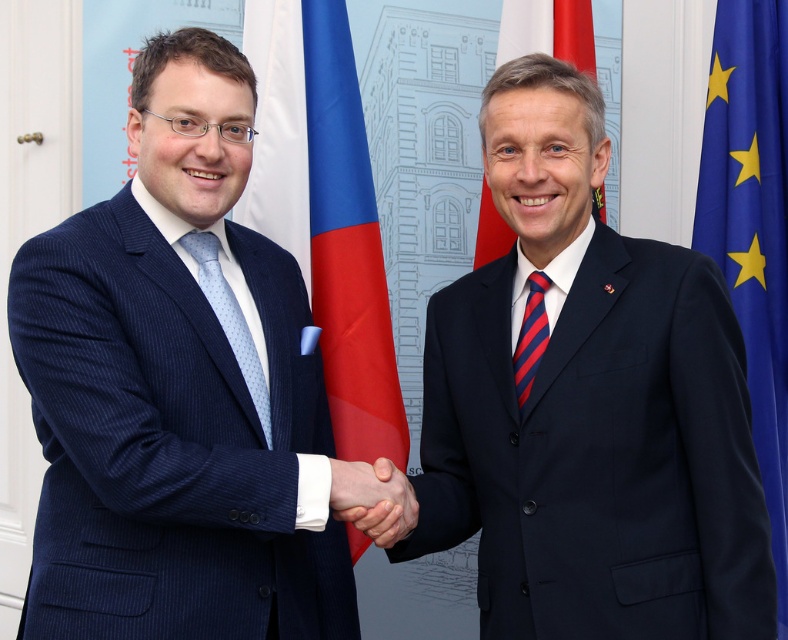
Between blue pinstripe suit at left and smooth skin hand at center, which one appears on the right side from the viewer's perspective?

Positioned to the right is smooth skin hand at center.

From the picture: Does blue pinstripe suit at left appear over smooth skin hand at center?

Correct, blue pinstripe suit at left is located above smooth skin hand at center.

Who is more forward, (136, 344) or (329, 490)?

Point (136, 344)

Find the location of a particular element. This screenshot has width=788, height=640. blue pinstripe suit at left is located at coordinates (177, 390).

Measure the distance between dark blue suit at center and blue fabric flag at right.

A distance of 83.24 centimeters exists between dark blue suit at center and blue fabric flag at right.

Can you confirm if dark blue suit at center is smaller than blue fabric flag at right?

Actually, dark blue suit at center might be larger than blue fabric flag at right.

You are a GUI agent. You are given a task and a screenshot of the screen. Output one action in this format:
    pyautogui.click(x=<x>, y=<y>)
    Task: Click on the dark blue suit at center
    Image resolution: width=788 pixels, height=640 pixels.
    Given the screenshot: What is the action you would take?
    pyautogui.click(x=589, y=404)

Who is positioned more to the right, blue fabric flag at right or polished wood flag at upper center?

From the viewer's perspective, blue fabric flag at right appears more on the right side.

Is blue fabric flag at right taller than polished wood flag at upper center?

Correct, blue fabric flag at right is much taller as polished wood flag at upper center.

Is point (768, 474) positioned in front of point (574, 44)?

Yes.

At what (x,y) coordinates should I click in order to perform the action: click on blue fabric flag at right. Please return your answer as a coordinate pair (x, y). This screenshot has width=788, height=640. Looking at the image, I should click on (753, 225).